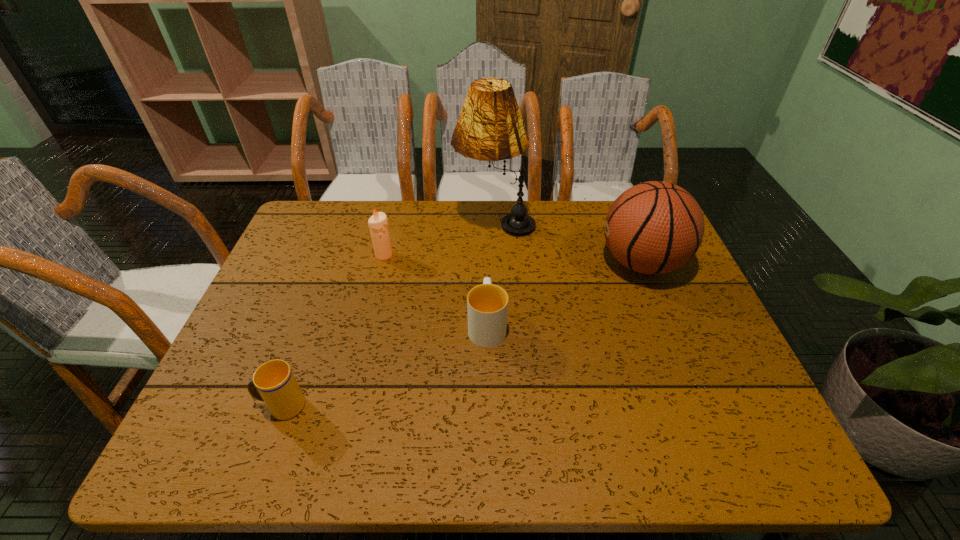
At what (x,y) coordinates should I click in order to perform the action: click on vacant space that's between the nearest object and the candle. Please return your answer as a coordinate pair (x, y). Looking at the image, I should click on (333, 330).

Locate an element on the screen. vacant space in between the lampshade and the basketball is located at coordinates (568, 243).

Find the location of a particular element. This screenshot has width=960, height=540. free space between the lampshade and the nearest object is located at coordinates (388, 314).

Point out which object is positioned as the nearest to the lampshade. Please provide its 2D coordinates. Your answer should be formatted as a tuple, i.e. [(x, y)], where the tuple contains the x and y coordinates of a point satisfying the conditions above.

[(655, 227)]

Select which object is the fourth closest to the fourth object from right to left. Please provide its 2D coordinates. Your answer should be formatted as a tuple, i.e. [(x, y)], where the tuple contains the x and y coordinates of a point satisfying the conditions above.

[(655, 227)]

Find the location of `free location that satisfies the following two spatial constraints: 1. on the side of the left cup with the handle; 2. on the right side of the third tallest object`. free location that satisfies the following two spatial constraints: 1. on the side of the left cup with the handle; 2. on the right side of the third tallest object is located at coordinates (337, 255).

This screenshot has height=540, width=960. What are the coordinates of `free space that satisfies the following two spatial constraints: 1. on the side of the leftmost object with the handle; 2. on the back side of the candle` in the screenshot? It's located at (337, 255).

In order to click on vacant region that satisfies the following two spatial constraints: 1. on the side of the nearer cup with the handle; 2. on the back side of the candle in this screenshot , I will do `click(337, 255)`.

You are a GUI agent. You are given a task and a screenshot of the screen. Output one action in this format:
    pyautogui.click(x=<x>, y=<y>)
    Task: Click on the vacant space that satisfies the following two spatial constraints: 1. on the side of the left cup with the handle; 2. on the left side of the third shortest object
    
    Given the screenshot: What is the action you would take?
    pyautogui.click(x=337, y=255)

The height and width of the screenshot is (540, 960). Find the location of `vacant area that satisfies the following two spatial constraints: 1. on the side of the nearer cup with the handle; 2. on the left side of the third tallest object`. vacant area that satisfies the following two spatial constraints: 1. on the side of the nearer cup with the handle; 2. on the left side of the third tallest object is located at coordinates (337, 255).